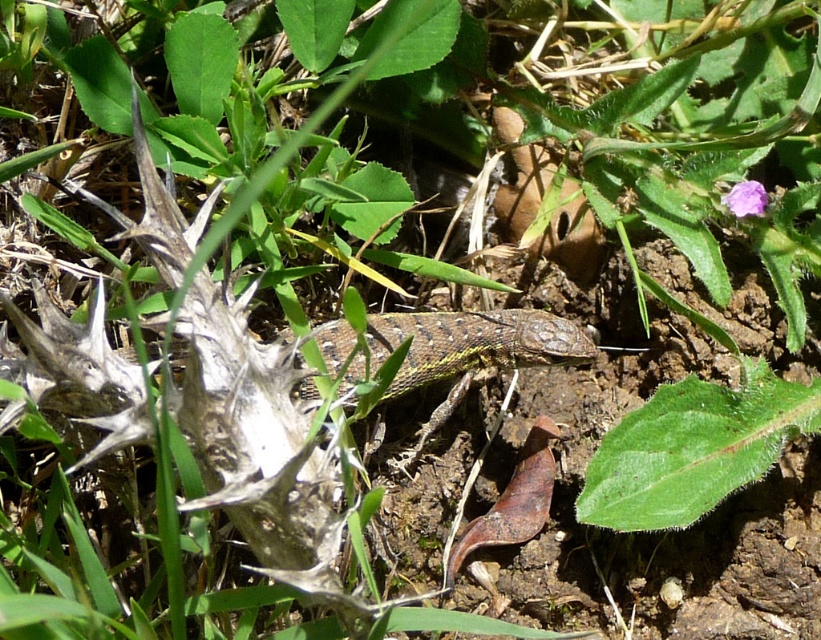
Question: Among these points, which one is farthest from the camera?

Choices:
 (A) (754, 202)
 (B) (445, 353)

Answer: (A)

Question: Is green scaly lizard at center smaller than purple matte flower at upper right?

Choices:
 (A) no
 (B) yes

Answer: (A)

Question: Which object is closer to the camera taking this photo?

Choices:
 (A) purple matte flower at upper right
 (B) green scaly lizard at center

Answer: (B)

Question: Which of the following is the farthest from the observer?

Choices:
 (A) (754, 195)
 (B) (352, 365)

Answer: (A)

Question: Is green scaly lizard at center further to the viewer compared to purple matte flower at upper right?

Choices:
 (A) yes
 (B) no

Answer: (B)

Question: Where is green scaly lizard at center located in relation to purple matte flower at upper right in the image?

Choices:
 (A) above
 (B) below

Answer: (B)